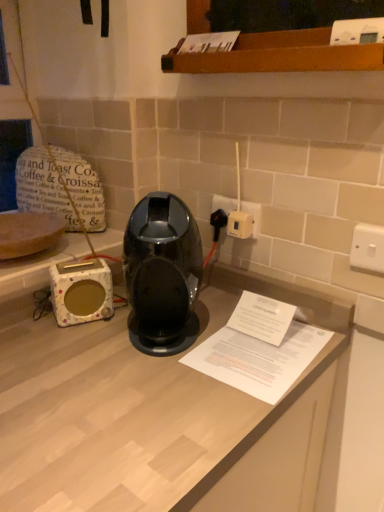
Find the location of `free space above white paper at center (from a real-world perspective)`. free space above white paper at center (from a real-world perspective) is located at coordinates (268, 344).